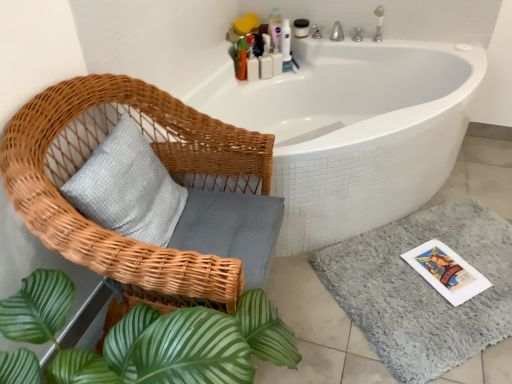
Question: Based on their sizes in the image, would you say gray shaggy bath mat at lower right is bigger or smaller than white plastic bottles at upper center, which is the fourth toiletry from right to left?

Choices:
 (A) big
 (B) small

Answer: (A)

Question: In the image, is gray shaggy bath mat at lower right positioned in front of or behind white plastic bottles at upper center, which is the fourth toiletry from right to left?

Choices:
 (A) front
 (B) behind

Answer: (A)

Question: Which object is positioned closest to the gray shaggy bath mat at lower right?

Choices:
 (A) matte white jar at upper center, which ranks as the first toiletry in right-to-left order
 (B) translucent plastic bottles at upper right, the fifth toiletry positioned from the right
 (C) white plastic bottles at upper center, the second toiletry when ordered from left to right
 (D) pink plastic bottle at upper center, acting as the third toiletry starting from the right
 (E) white glossy bathtub at upper center

Answer: (E)

Question: Considering the real-world distances, which object is closest to the white glossy bathtub at upper center?

Choices:
 (A) translucent plastic bottles at upper right, the fifth toiletry positioned from the right
 (B) gray shaggy bath mat at lower right
 (C) white plastic bottles at upper center, positioned as the second toiletry in right-to-left order
 (D) matte white jar at upper center, which ranks as the first toiletry in right-to-left order
 (E) white plastic bottles at upper center, the second toiletry when ordered from left to right

Answer: (B)